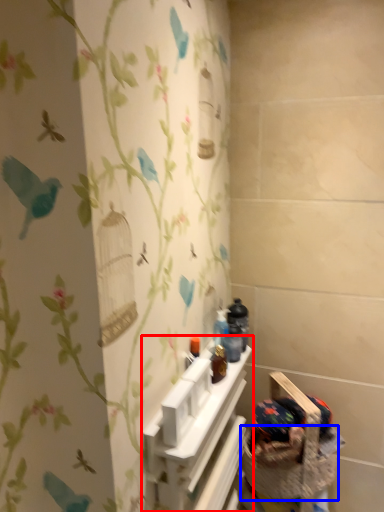
Question: Among these objects, which one is farthest to the camera, shelf (highlighted by a red box) or basket container (highlighted by a blue box)?

Choices:
 (A) shelf
 (B) basket container

Answer: (B)